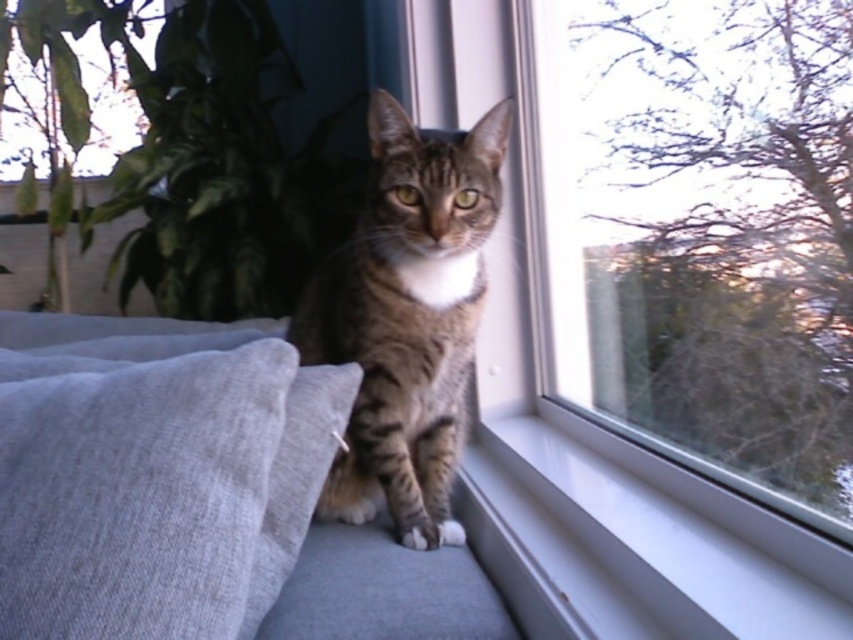
You are standing in the room and want to sit on the light gray fabric couch at center. Based on the coordinates provided, where exactly should you position yourself to sit comfortably on the couch?

The light gray fabric couch at center is located at coordinates point (194, 493), so you should position yourself there to sit comfortably on the couch.

You are a cat owner who wants to place a new cat tree in the living room. You see the light gray fabric couch at center and the transparent glass window at center. Which object is closer to the floor?

The light gray fabric couch at center is located below the transparent glass window at center, so the light gray fabric couch at center is closer to the floor.

You are a cat owner who wants to place a new rectangular cat tree in the living room. The cat tree is 1.2 meters wide. You see the light gray fabric couch at center and the transparent glass window at center. Which object is wider, and can the cat tree fit next to it?

The transparent glass window at center is wider than the light gray fabric couch at center. Since the cat tree is 1.2 meters wide, it can fit next to the wider transparent glass window at center if there is sufficient space available.